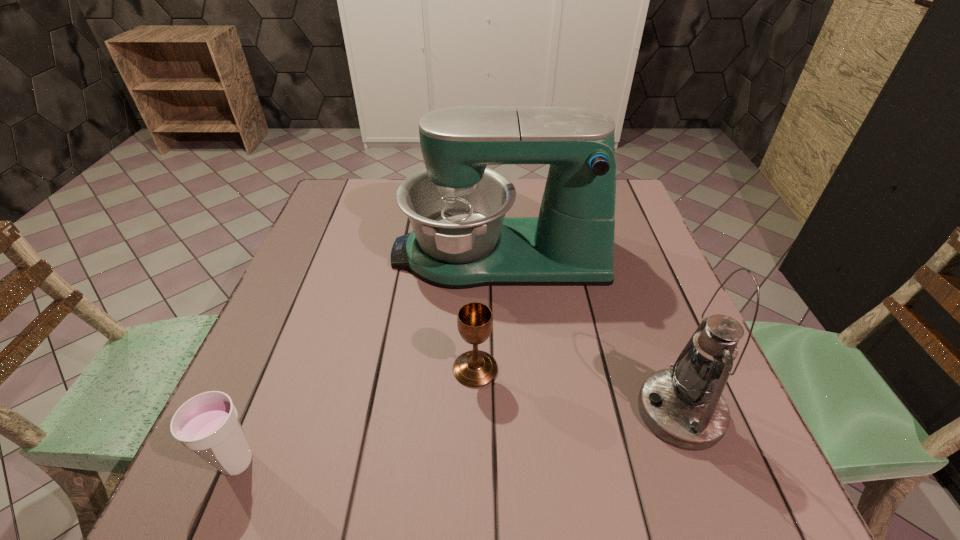
Locate an element on the screen. the farthest object is located at coordinates (461, 238).

Locate an element on the screen. oil lamp is located at coordinates (684, 407).

Find the location of `chalice`. chalice is located at coordinates (475, 368).

Identify the location of cup. (208, 424).

At what (x,y) coordinates should I click in order to perform the action: click on vacant area situated 0.080m on the front-facing side of the farthest object. Please return your answer as a coordinate pair (x, y). Image resolution: width=960 pixels, height=540 pixels. Looking at the image, I should click on (361, 255).

Image resolution: width=960 pixels, height=540 pixels. What are the coordinates of `vacant space located 0.070m on the front-facing side of the farthest object` in the screenshot? It's located at (365, 255).

Find the location of a particular element. The image size is (960, 540). free space located 0.090m on the back of the oil lamp is located at coordinates (654, 341).

At what (x,y) coordinates should I click in order to perform the action: click on vacant space located 0.370m on the left of the chalice. Please return your answer as a coordinate pair (x, y). Looking at the image, I should click on (264, 369).

Identify the location of free point located 0.170m on the back of the leftmost object. The width and height of the screenshot is (960, 540). (280, 359).

Where is `object present at the far edge`? This screenshot has height=540, width=960. object present at the far edge is located at coordinates (461, 238).